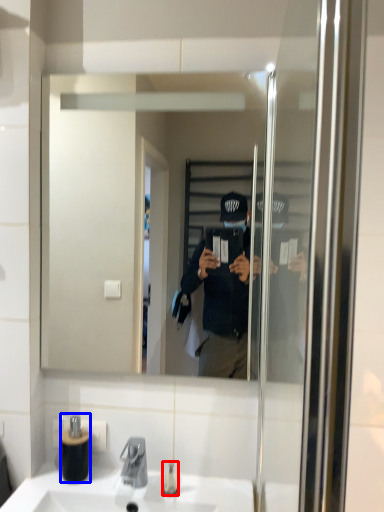
Question: Which object is closer to the camera taking this photo, toiletry (highlighted by a red box) or bottle (highlighted by a blue box)?

Choices:
 (A) toiletry
 (B) bottle

Answer: (A)